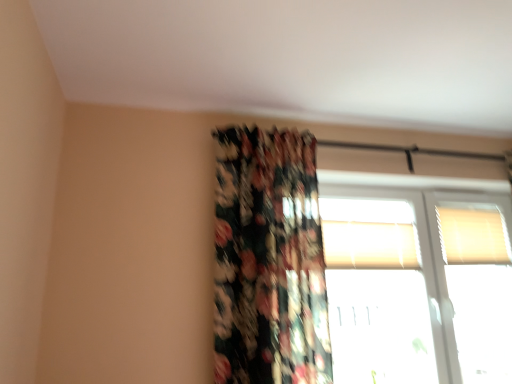
What is the approximate height of transparent glass window at upper right, marked as the 1th window in a bottom-to-top arrangement?

transparent glass window at upper right, marked as the 1th window in a bottom-to-top arrangement, is 1.22 meters in height.

This screenshot has height=384, width=512. Describe the element at coordinates (269, 260) in the screenshot. I see `floral fabric curtain at center` at that location.

I want to click on transparent glass window at upper right, the third window when ordered from top to bottom, so click(x=418, y=278).

Based on the photo, is white textured blinds at upper center, the second window ordered from the bottom, directly adjacent to floral fabric curtain at center?

No, white textured blinds at upper center, the second window ordered from the bottom, is not with floral fabric curtain at center.

Could you tell me if white textured blinds at upper center, the second window ordered from the bottom, is facing floral fabric curtain at center?

No.

Is white textured blinds at upper center, the second window ordered from the bottom, wider or thinner than floral fabric curtain at center?

Clearly, white textured blinds at upper center, the second window ordered from the bottom, has less width compared to floral fabric curtain at center.

Looking at this image, from a real-world perspective, which object stands above the other?

white textured blinds at upper center, acting as the 2th window starting from the top, is physically above.

Considering the positions of objects floral fabric curtain at center and white textured blinds at upper center, acting as the 2th window starting from the top, in the image provided, who is behind, floral fabric curtain at center or white textured blinds at upper center, acting as the 2th window starting from the top,?

white textured blinds at upper center, acting as the 2th window starting from the top, is further away from the camera.

Is floral fabric curtain at center directly adjacent to white textured blinds at upper center, the second window ordered from the bottom?

floral fabric curtain at center and white textured blinds at upper center, the second window ordered from the bottom, are clearly separated.

Looking at this image, is the depth of white textured blinds at upper right, the 3th window positioned from the bottom, less than that of transparent glass window at upper right, the third window when ordered from top to bottom?

That is False.

This screenshot has height=384, width=512. Identify the location of the 2nd window located beneath the white textured blinds at upper right, positioned as the first window in top-to-bottom order (from a real-world perspective). (418, 278).

Between transparent glass window at upper right, the third window when ordered from top to bottom, and floral fabric curtain at center, which one has smaller width?

Thinner between the two is transparent glass window at upper right, the third window when ordered from top to bottom.

Relative to floral fabric curtain at center, is transparent glass window at upper right, marked as the 1th window in a bottom-to-top arrangement, in front or behind?

In the image, transparent glass window at upper right, marked as the 1th window in a bottom-to-top arrangement, appears behind floral fabric curtain at center.

Measure the distance between floral fabric curtain at center and white textured blinds at upper right, positioned as the first window in top-to-bottom order.

The distance of floral fabric curtain at center from white textured blinds at upper right, positioned as the first window in top-to-bottom order, is 4.04 feet.

Which is closer to the camera, (273,337) or (499,250)?

Point (273,337) is closer to the camera than point (499,250).

Consider the image. What's the angular difference between floral fabric curtain at center and white textured blinds at upper right, positioned as the first window in top-to-bottom order,'s facing directions?

There is a 0.443-degree angle between the facing directions of floral fabric curtain at center and white textured blinds at upper right, positioned as the first window in top-to-bottom order.

Could you tell me if floral fabric curtain at center is turned towards white textured blinds at upper right, positioned as the first window in top-to-bottom order?

No, floral fabric curtain at center does not turn towards white textured blinds at upper right, positioned as the first window in top-to-bottom order.

From the image's perspective, which is below, transparent glass window at upper right, the third window when ordered from top to bottom, or white textured blinds at upper center, acting as the 2th window starting from the top?

transparent glass window at upper right, the third window when ordered from top to bottom.

From a real-world perspective, which object rests below the other?

In real-world perspective, transparent glass window at upper right, marked as the 1th window in a bottom-to-top arrangement, is lower.

Is point (432, 212) farther from viewer compared to point (323, 239)?

Yes, point (432, 212) is farther from viewer.

Find the location of a particular element. the 1st window counting from the right of the white textured blinds at upper center, the second window ordered from the bottom is located at coordinates (418, 278).

From the image's perspective, is transparent glass window at upper right, marked as the 1th window in a bottom-to-top arrangement, located above or below white textured blinds at upper right, positioned as the first window in top-to-bottom order?

Based on their image positions, transparent glass window at upper right, marked as the 1th window in a bottom-to-top arrangement, is located beneath white textured blinds at upper right, positioned as the first window in top-to-bottom order.

Is transparent glass window at upper right, marked as the 1th window in a bottom-to-top arrangement, far away from white textured blinds at upper right, the 3th window positioned from the bottom?

Actually, transparent glass window at upper right, marked as the 1th window in a bottom-to-top arrangement, and white textured blinds at upper right, the 3th window positioned from the bottom, are a little close together.

Is transparent glass window at upper right, the third window when ordered from top to bottom, shorter than white textured blinds at upper right, the 3th window positioned from the bottom?

Incorrect, the height of transparent glass window at upper right, the third window when ordered from top to bottom, does not fall short of that of white textured blinds at upper right, the 3th window positioned from the bottom.

Would you say transparent glass window at upper right, marked as the 1th window in a bottom-to-top arrangement, is outside white textured blinds at upper right, the 3th window positioned from the bottom?

Indeed, transparent glass window at upper right, marked as the 1th window in a bottom-to-top arrangement, is completely outside white textured blinds at upper right, the 3th window positioned from the bottom.

Identify the location of curtain in front of the white textured blinds at upper center, the second window ordered from the bottom. The height and width of the screenshot is (384, 512). (269, 260).

What are the coordinates of `the 2nd window behind the floral fabric curtain at center, counting from the anchor's position` in the screenshot? It's located at (369, 234).

Based on the photo, estimate the real-world distances between objects in this image. Which object is further from floral fabric curtain at center, transparent glass window at upper right, marked as the 1th window in a bottom-to-top arrangement, or white textured blinds at upper right, the 3th window positioned from the bottom?

Among the two, white textured blinds at upper right, the 3th window positioned from the bottom, is located further to floral fabric curtain at center.

Estimate the real-world distances between objects in this image. Which object is further from white textured blinds at upper right, the 3th window positioned from the bottom, white textured blinds at upper center, acting as the 2th window starting from the top, or floral fabric curtain at center?

The object further to white textured blinds at upper right, the 3th window positioned from the bottom, is floral fabric curtain at center.

Considering their positions, is transparent glass window at upper right, the third window when ordered from top to bottom, positioned closer to white textured blinds at upper right, the 3th window positioned from the bottom, than white textured blinds at upper center, acting as the 2th window starting from the top?

transparent glass window at upper right, the third window when ordered from top to bottom.

From the picture: Estimate the real-world distances between objects in this image. Which object is closer to white textured blinds at upper right, positioned as the first window in top-to-bottom order, floral fabric curtain at center or transparent glass window at upper right, marked as the 1th window in a bottom-to-top arrangement?

Based on the image, transparent glass window at upper right, marked as the 1th window in a bottom-to-top arrangement, appears to be nearer to white textured blinds at upper right, positioned as the first window in top-to-bottom order.

Based on their spatial positions, is transparent glass window at upper right, the third window when ordered from top to bottom, or white textured blinds at upper center, acting as the 2th window starting from the top, closer to floral fabric curtain at center?

The object closer to floral fabric curtain at center is white textured blinds at upper center, acting as the 2th window starting from the top.

Estimate the real-world distances between objects in this image. Which object is further from white textured blinds at upper center, the second window ordered from the bottom, transparent glass window at upper right, marked as the 1th window in a bottom-to-top arrangement, or white textured blinds at upper right, the 3th window positioned from the bottom?

Based on the image, white textured blinds at upper right, the 3th window positioned from the bottom, appears to be further to white textured blinds at upper center, the second window ordered from the bottom.

Estimate the real-world distances between objects in this image. Which object is further from transparent glass window at upper right, the third window when ordered from top to bottom, white textured blinds at upper right, the 3th window positioned from the bottom, or white textured blinds at upper center, acting as the 2th window starting from the top?

white textured blinds at upper right, the 3th window positioned from the bottom, lies further to transparent glass window at upper right, the third window when ordered from top to bottom, than the other object.

From the image, which object appears to be farther from white textured blinds at upper center, the second window ordered from the bottom, transparent glass window at upper right, marked as the 1th window in a bottom-to-top arrangement, or floral fabric curtain at center?

The object further to white textured blinds at upper center, the second window ordered from the bottom, is floral fabric curtain at center.

Where is `window between floral fabric curtain at center and transparent glass window at upper right, the third window when ordered from top to bottom`? The width and height of the screenshot is (512, 384). window between floral fabric curtain at center and transparent glass window at upper right, the third window when ordered from top to bottom is located at coordinates (369, 234).

The image size is (512, 384). Find the location of `window situated between white textured blinds at upper center, the second window ordered from the bottom, and white textured blinds at upper right, positioned as the first window in top-to-bottom order, from left to right`. window situated between white textured blinds at upper center, the second window ordered from the bottom, and white textured blinds at upper right, positioned as the first window in top-to-bottom order, from left to right is located at coordinates (418, 278).